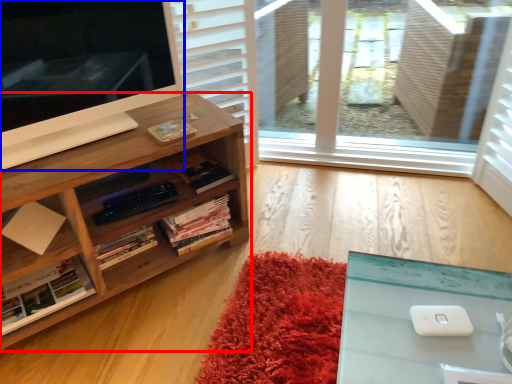
Question: Which point is closer to the camera, bookcase (highlighted by a red box) or computer monitor (highlighted by a blue box)?

Choices:
 (A) bookcase
 (B) computer monitor

Answer: (B)